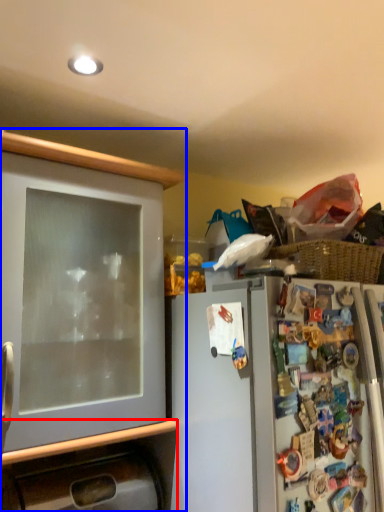
Question: Which of the following is the closest to the observer, cabinetry (highlighted by a red box) or cabinetry (highlighted by a blue box)?

Choices:
 (A) cabinetry
 (B) cabinetry

Answer: (B)